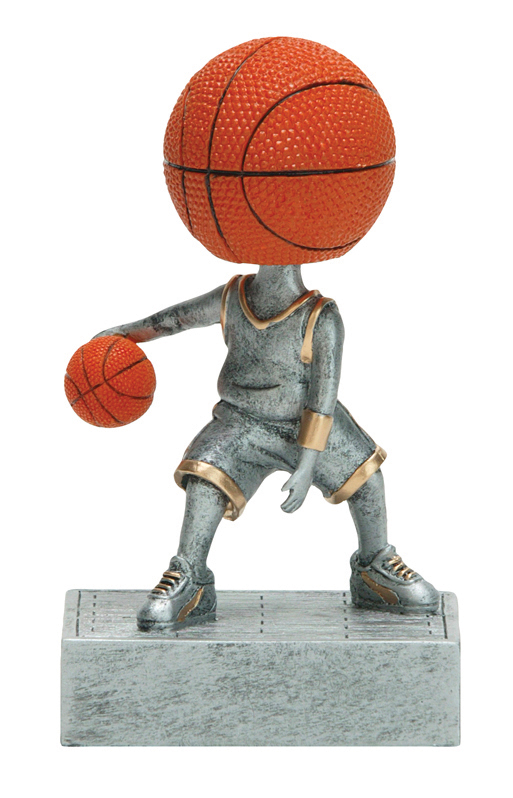
Where is `trophy base`? Image resolution: width=513 pixels, height=798 pixels. trophy base is located at coordinates (244, 689).